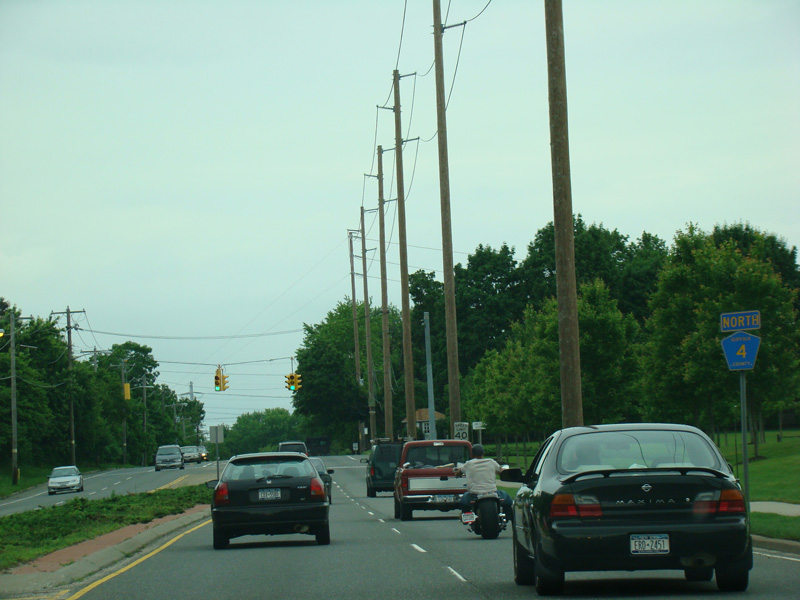
Identify the location of green light. (216, 391), (292, 388).